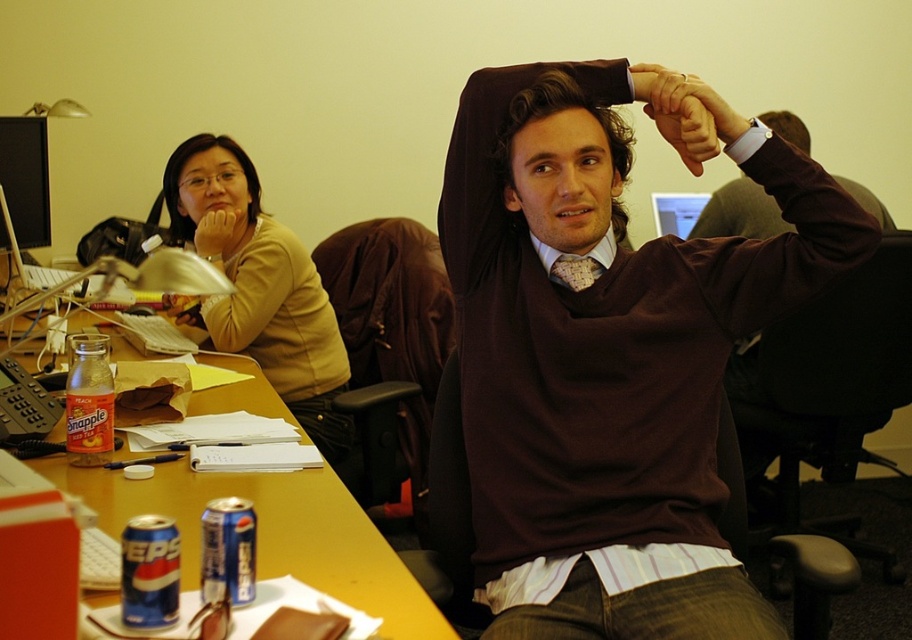
Question: Which point is farther to the camera?

Choices:
 (A) (607, 186)
 (B) (509, 136)
 (C) (210, 198)
 (D) (329, 468)

Answer: (C)

Question: Can you confirm if yellow wood desk at center is wider than matte yellow sweater at left?

Choices:
 (A) yes
 (B) no

Answer: (A)

Question: Based on their relative distances, which object is nearer to the yellow wood desk at center?

Choices:
 (A) matte yellow shirt at upper left
 (B) matte yellow sweater at left

Answer: (B)

Question: From the image, what is the correct spatial relationship of yellow wood desk at center in relation to matte black hand at upper center?

Choices:
 (A) right
 (B) left

Answer: (B)

Question: Among these objects, which one is farthest from the camera?

Choices:
 (A) matte black hand at upper center
 (B) matte yellow shirt at upper left

Answer: (B)

Question: Is yellow wood desk at center wider than matte yellow sweater at left?

Choices:
 (A) no
 (B) yes

Answer: (B)